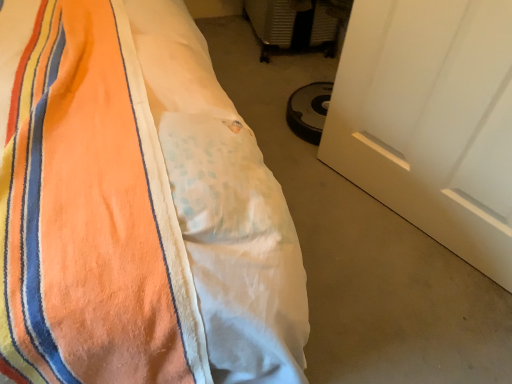
Question: Which is correct: orange fleece blanket at left is inside white matte door at lower right, or outside of it?

Choices:
 (A) inside
 (B) outside

Answer: (B)

Question: Is orange fleece blanket at left wider or thinner than white matte door at lower right?

Choices:
 (A) thin
 (B) wide

Answer: (B)

Question: Estimate the real-world distances between objects in this image. Which object is farther from the white matte door at lower right?

Choices:
 (A) orange fleece blanket at left
 (B) white fabric at lower left

Answer: (A)

Question: Which of these objects is positioned closest to the white fabric at lower left?

Choices:
 (A) white matte door at lower right
 (B) orange fleece blanket at left

Answer: (A)